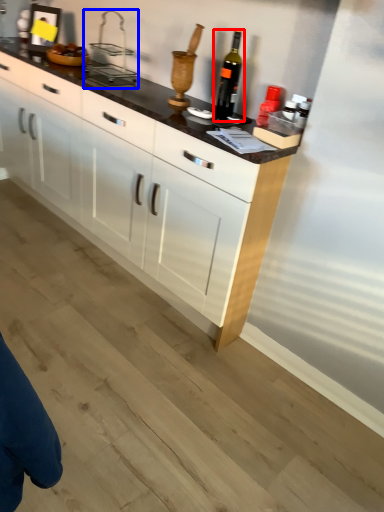
Question: Among these objects, which one is farthest to the camera, wine bottle (highlighted by a red box) or appliance (highlighted by a blue box)?

Choices:
 (A) wine bottle
 (B) appliance

Answer: (B)